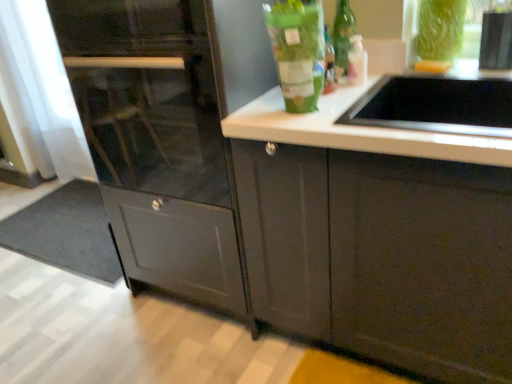
In order to click on gray matte doormat at lower left in this screenshot , I will do pos(66,232).

In the image, is gray matte doormat at lower left positioned in front of or behind green matte bag at upper center, which is counted as the 1th bottle, starting from the front?

Clearly, gray matte doormat at lower left is behind green matte bag at upper center, which is counted as the 1th bottle, starting from the front.

Looking at this image, is gray matte doormat at lower left next to green matte bag at upper center, which is counted as the second bottle, starting from the right, and touching it?

There is a gap between gray matte doormat at lower left and green matte bag at upper center, which is counted as the second bottle, starting from the right.

Looking at this image, which of these two, gray matte doormat at lower left or green matte bag at upper center, the 1th bottle viewed from the left, is smaller?

green matte bag at upper center, the 1th bottle viewed from the left.

This screenshot has height=384, width=512. What are the coordinates of `doormat located behind the green matte bag at upper center, the second bottle positioned from the back` in the screenshot? It's located at (66, 232).

Considering the relative positions of matte gray cabinet at center and gray matte doormat at lower left in the image provided, is matte gray cabinet at center to the left of gray matte doormat at lower left from the viewer's perspective?

In fact, matte gray cabinet at center is to the right of gray matte doormat at lower left.

Could you tell me if matte gray cabinet at center is facing gray matte doormat at lower left?

No, matte gray cabinet at center is not turned towards gray matte doormat at lower left.

Which object is further away from the camera taking this photo, matte gray cabinet at center or gray matte doormat at lower left?

gray matte doormat at lower left.

Is there a large distance between green glass vase at upper right and translucent glass bottle at upper right, the 2th bottle from the front?

They are positioned close to each other.

In the image, is green glass vase at upper right on the left side or the right side of translucent glass bottle at upper right, the 2th bottle from the front?

Clearly, green glass vase at upper right is on the right of translucent glass bottle at upper right, the 2th bottle from the front, in the image.

Is green glass vase at upper right wider than translucent glass bottle at upper right, which is the 2th bottle in left-to-right order?

Yes.

Based on the photo, from the image's perspective, is green glass vase at upper right beneath translucent glass bottle at upper right, which is the 2th bottle in left-to-right order?

Incorrect, from the image's perspective, green glass vase at upper right is higher than translucent glass bottle at upper right, which is the 2th bottle in left-to-right order.

From the image's perspective, is matte gray cabinet at center located above or below translucent glass bottle at upper right, placed as the first bottle when sorted from right to left?

Based on their image positions, matte gray cabinet at center is located beneath translucent glass bottle at upper right, placed as the first bottle when sorted from right to left.

Is the surface of matte gray cabinet at center in direct contact with translucent glass bottle at upper right, placed as the first bottle when sorted from right to left?

matte gray cabinet at center and translucent glass bottle at upper right, placed as the first bottle when sorted from right to left, are not in contact.

Which of these two, matte gray cabinet at center or translucent glass bottle at upper right, which is the 2th bottle in left-to-right order, is smaller?

translucent glass bottle at upper right, which is the 2th bottle in left-to-right order.

Does matte gray cabinet at center appear on the left side of translucent glass bottle at upper right, which is the 2th bottle in left-to-right order?

Indeed, matte gray cabinet at center is positioned on the left side of translucent glass bottle at upper right, which is the 2th bottle in left-to-right order.

Is green glass vase at upper right turned away from green matte bag at upper center, which is counted as the 1th bottle, starting from the front?

No, green glass vase at upper right is not facing the opposite direction of green matte bag at upper center, which is counted as the 1th bottle, starting from the front.

Is green glass vase at upper right to the right of green matte bag at upper center, which is counted as the 1th bottle, starting from the front, from the viewer's perspective?

Yes.

Could green matte bag at upper center, which is counted as the 1th bottle, starting from the front, be considered to be inside green glass vase at upper right?

No.

From a real-world perspective, is green glass vase at upper right positioned under green matte bag at upper center, the 1th bottle viewed from the left, based on gravity?

Yes, from a real-world perspective, green glass vase at upper right is beneath green matte bag at upper center, the 1th bottle viewed from the left.

Between green glass vase at upper right and gray matte doormat at lower left, which one is positioned in front?

green glass vase at upper right is more forward.

Can you confirm if green glass vase at upper right is bigger than gray matte doormat at lower left?

Incorrect, green glass vase at upper right is not larger than gray matte doormat at lower left.

Does green glass vase at upper right appear on the right side of gray matte doormat at lower left?

Indeed, green glass vase at upper right is positioned on the right side of gray matte doormat at lower left.

How distant is green glass vase at upper right from gray matte doormat at lower left?

They are 6.55 feet apart.

From a real-world perspective, which object stands above the other?

green matte bag at upper center, which is counted as the second bottle, starting from the right, from a real-world perspective.

Which object is more forward, green matte bag at upper center, which is counted as the 1th bottle, starting from the front, or green glass vase at upper right?

Positioned in front is green matte bag at upper center, which is counted as the 1th bottle, starting from the front.

From the image's perspective, which object appears higher, green matte bag at upper center, which is counted as the 1th bottle, starting from the front, or green glass vase at upper right?

From the image's view, green glass vase at upper right is above.

Is the surface of green matte bag at upper center, the 1th bottle viewed from the left, in direct contact with green glass vase at upper right?

No, green matte bag at upper center, the 1th bottle viewed from the left, is not making contact with green glass vase at upper right.

From the gray matte doormat at lower left, count 1st bottle to the right and point to it. Please provide its 2D coordinates.

[(297, 52)]

The height and width of the screenshot is (384, 512). What are the coordinates of `cabinetry located above the gray matte doormat at lower left (from the image's perspective)` in the screenshot? It's located at (158, 142).

Based on their spatial positions, is gray matte doormat at lower left or green glass vase at upper right closer to green matte bag at upper center, which is counted as the second bottle, starting from the right?

Based on the image, green glass vase at upper right appears to be nearer to green matte bag at upper center, which is counted as the second bottle, starting from the right.

Estimate the real-world distances between objects in this image. Which object is further from translucent glass bottle at upper right, which is the 2th bottle in left-to-right order, green glass vase at upper right or green matte bag at upper center, the 1th bottle viewed from the left?

green matte bag at upper center, the 1th bottle viewed from the left, lies further to translucent glass bottle at upper right, which is the 2th bottle in left-to-right order, than the other object.

When comparing their distances from gray matte doormat at lower left, does green glass bottle at upper center or green glass vase at upper right seem closer?

green glass bottle at upper center is closer to gray matte doormat at lower left.

Estimate the real-world distances between objects in this image. Which object is further from green glass vase at upper right, green glass bottle at upper center or translucent glass bottle at upper right, the 2th bottle from the front?

green glass bottle at upper center is further to green glass vase at upper right.

Consider the image. Based on their spatial positions, is gray matte doormat at lower left or green matte bag at upper center, which is counted as the second bottle, starting from the right, closer to matte gray cabinet at center?

green matte bag at upper center, which is counted as the second bottle, starting from the right, is closer to matte gray cabinet at center.

Looking at the image, which one is located closer to green glass bottle at upper center, translucent glass bottle at upper right, which is the 2th bottle in left-to-right order, or gray matte doormat at lower left?

translucent glass bottle at upper right, which is the 2th bottle in left-to-right order.

Considering their positions, is green glass vase at upper right positioned closer to translucent glass bottle at upper right, which is the 2th bottle in left-to-right order, than matte gray cabinet at center?

green glass vase at upper right lies closer to translucent glass bottle at upper right, which is the 2th bottle in left-to-right order, than the other object.

From the image, which object appears to be nearer to matte gray cabinet at center, green glass vase at upper right or translucent glass bottle at upper right, placed as the first bottle when sorted from right to left?

translucent glass bottle at upper right, placed as the first bottle when sorted from right to left.

Where is `cabinetry positioned between green matte bag at upper center, which is counted as the second bottle, starting from the right, and gray matte doormat at lower left from near to far`? cabinetry positioned between green matte bag at upper center, which is counted as the second bottle, starting from the right, and gray matte doormat at lower left from near to far is located at coordinates (158, 142).

Find the location of a particular element. The image size is (512, 384). bottle between green matte bag at upper center, which is counted as the second bottle, starting from the right, and green glass vase at upper right is located at coordinates (357, 61).

Where is `bottle between matte gray cabinet at center and translucent glass bottle at upper right, which is the 2th bottle in left-to-right order, in the horizontal direction`? The height and width of the screenshot is (384, 512). bottle between matte gray cabinet at center and translucent glass bottle at upper right, which is the 2th bottle in left-to-right order, in the horizontal direction is located at coordinates (297, 52).

You are a GUI agent. You are given a task and a screenshot of the screen. Output one action in this format:
    pyautogui.click(x=<x>, y=<y>)
    Task: Click on the bottle between gray matte doormat at lower left and translucent glass bottle at upper right, which is the 2th bottle in left-to-right order
    This screenshot has height=384, width=512.
    Given the screenshot: What is the action you would take?
    pyautogui.click(x=297, y=52)